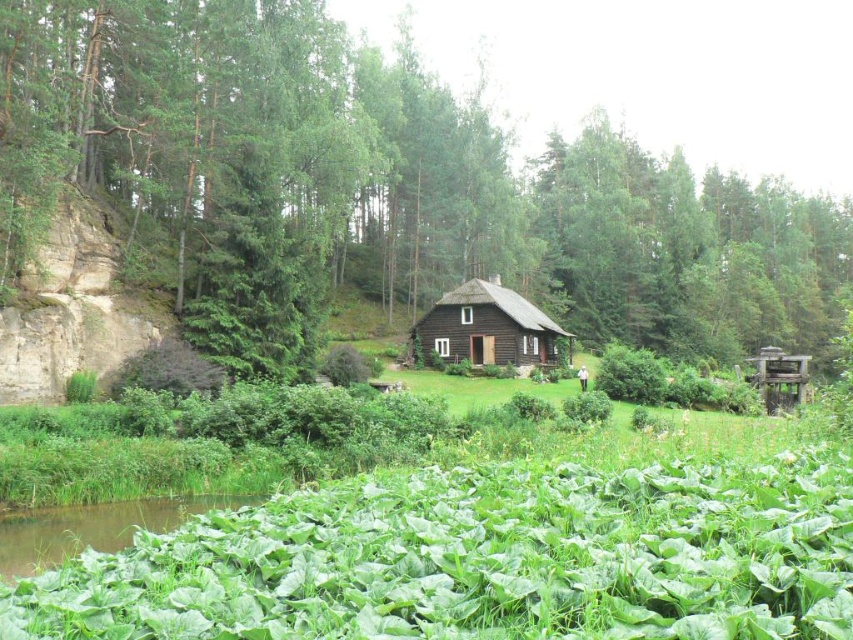
Question: Is green leafy tree at center closer to camera compared to dark brown wooden cottage at center?

Choices:
 (A) no
 (B) yes

Answer: (B)

Question: Among these objects, which one is nearest to the camera?

Choices:
 (A) dark brown wooden cottage at center
 (B) green leafy tree at center

Answer: (B)

Question: Does green leafy tree at center have a larger size compared to dark brown wooden cottage at center?

Choices:
 (A) yes
 (B) no

Answer: (A)

Question: Is green leafy tree at center to the right of dark brown wooden cottage at center from the viewer's perspective?

Choices:
 (A) yes
 (B) no

Answer: (A)